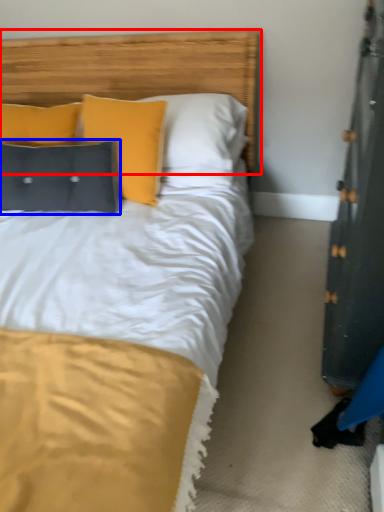
Question: Which object appears closest to the camera in this image, headboard (highlighted by a red box) or pillow (highlighted by a blue box)?

Choices:
 (A) headboard
 (B) pillow

Answer: (A)